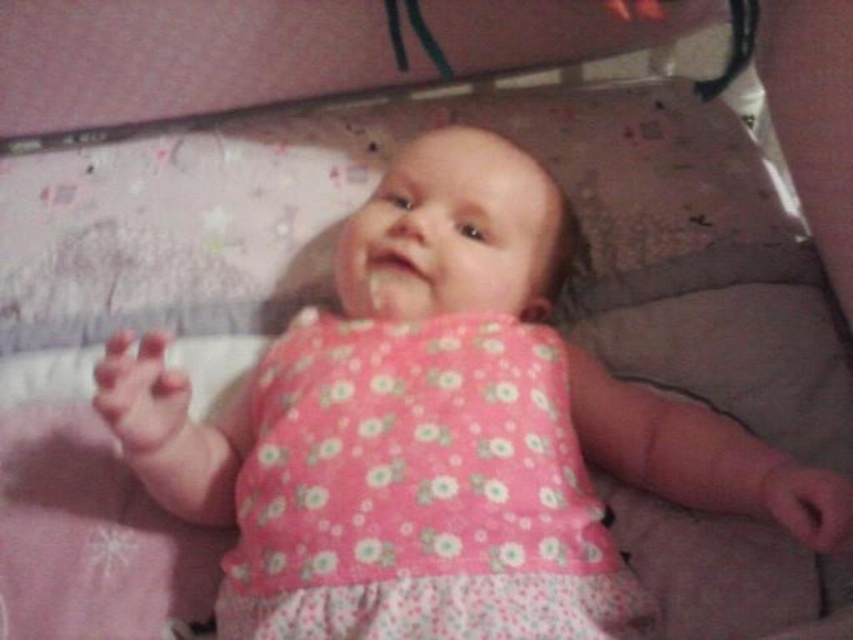
Question: Can you confirm if pink floral dress at center is smaller than pink floral fabric dress at center?

Choices:
 (A) yes
 (B) no

Answer: (B)

Question: Which object is closer to the camera taking this photo?

Choices:
 (A) pink floral fabric dress at center
 (B) pink floral dress at center

Answer: (A)

Question: Which object appears farthest from the camera in this image?

Choices:
 (A) pink floral fabric dress at center
 (B) pink floral dress at center

Answer: (B)

Question: Is the position of pink floral dress at center more distant than that of pink floral fabric dress at center?

Choices:
 (A) no
 (B) yes

Answer: (B)

Question: Can you confirm if pink floral dress at center is positioned to the right of pink floral fabric dress at center?

Choices:
 (A) no
 (B) yes

Answer: (A)

Question: Which point is closer to the camera?

Choices:
 (A) [270, 536]
 (B) [160, 483]

Answer: (A)